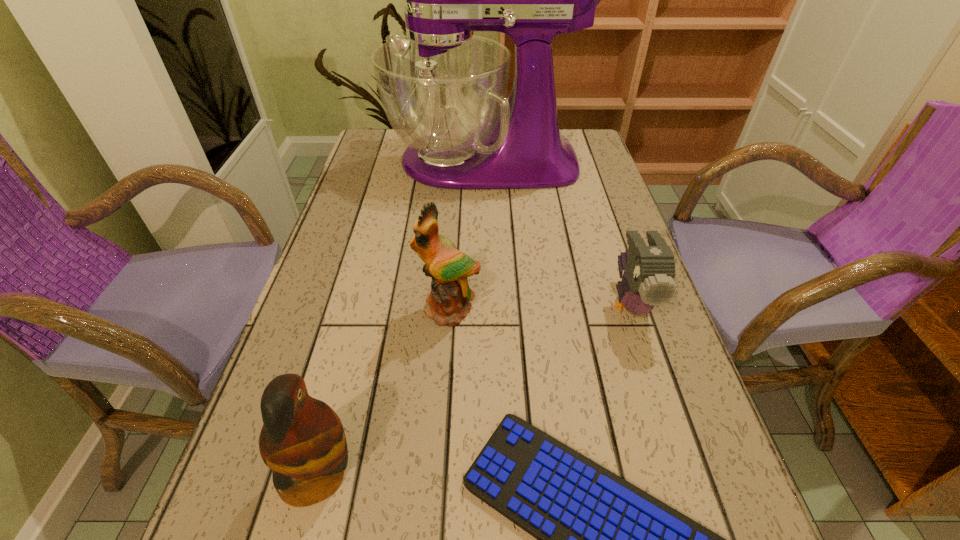
Where is `free space located 0.330m at the beak of the fourth tallest object`? The height and width of the screenshot is (540, 960). free space located 0.330m at the beak of the fourth tallest object is located at coordinates (704, 525).

The width and height of the screenshot is (960, 540). I want to click on object positioned at the far edge, so click(x=443, y=89).

At what (x,y) coordinates should I click in order to perform the action: click on mixer that is positioned at the left edge. Please return your answer as a coordinate pair (x, y). The width and height of the screenshot is (960, 540). Looking at the image, I should click on (443, 89).

The image size is (960, 540). What are the coordinates of `parrot that is positioned at the left edge` in the screenshot? It's located at (302, 440).

The width and height of the screenshot is (960, 540). I want to click on mixer at the right edge, so click(443, 89).

Find the location of `bird present at the right edge`. bird present at the right edge is located at coordinates (649, 271).

Find the location of a particular element. The height and width of the screenshot is (540, 960). object that is at the far left corner is located at coordinates (443, 89).

Image resolution: width=960 pixels, height=540 pixels. What are the coordinates of `object that is at the far right corner` in the screenshot? It's located at (443, 89).

The height and width of the screenshot is (540, 960). I want to click on free space at the left edge, so point(336,233).

Locate an element on the screen. The height and width of the screenshot is (540, 960). free space at the right edge of the desktop is located at coordinates (589, 271).